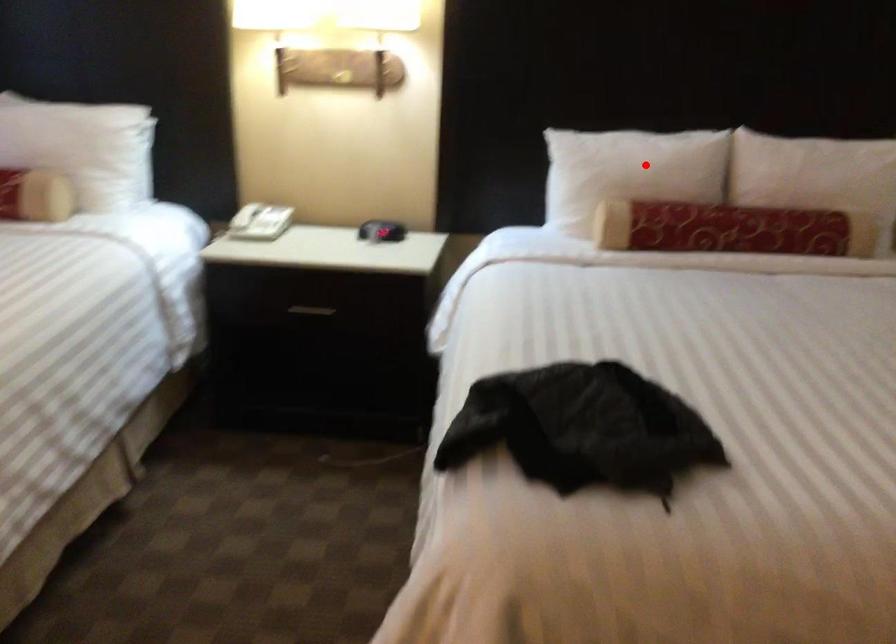
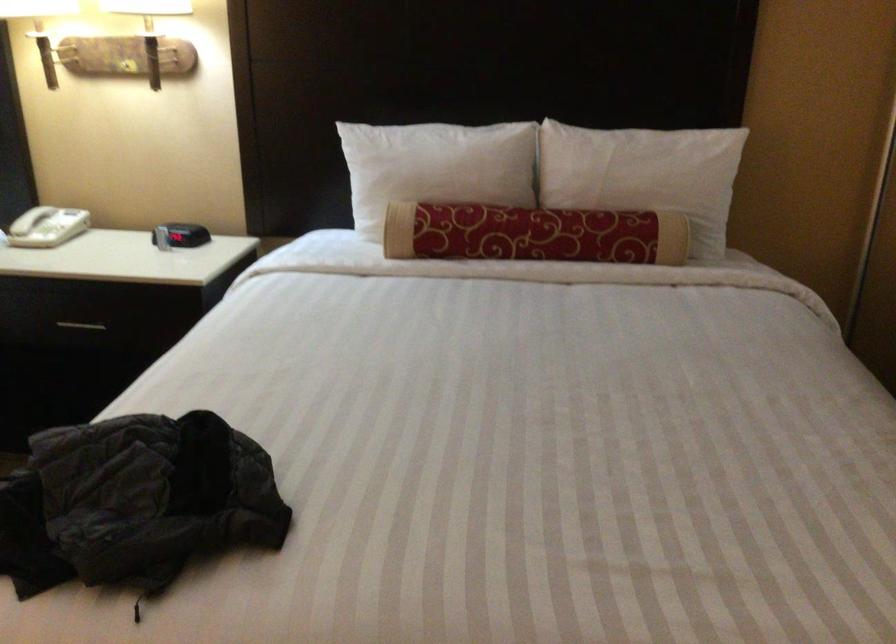
Question: I am providing you with two images of the same scene from different viewpoints. In image1, a red point is highlighted. Considering the same 3D point in image2, which of the following is correct?

Choices:
 (A) It is closer
 (B) It is farther

Answer: (A)